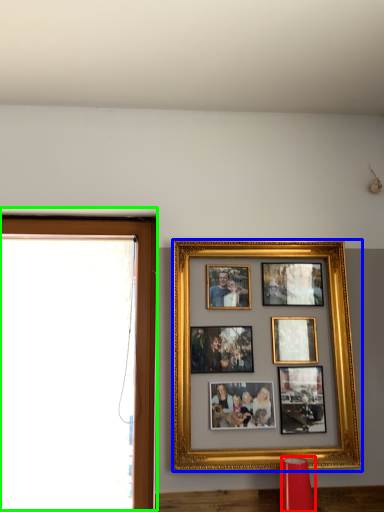
Question: Estimate the real-world distances between objects in this image. Which object is farther from lamp (highlighted by a red box), picture frame (highlighted by a blue box) or window frame (highlighted by a green box)?

Choices:
 (A) picture frame
 (B) window frame

Answer: (B)